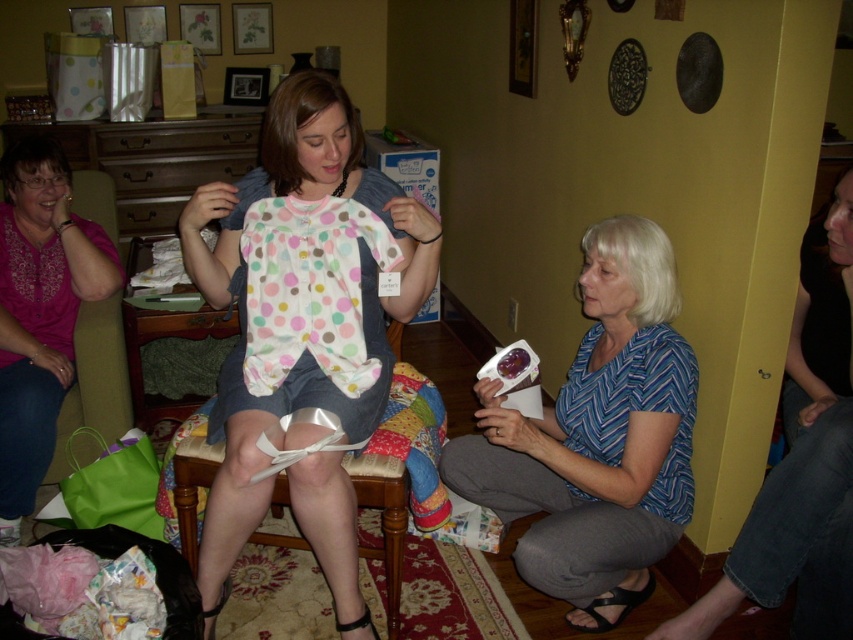
Question: Is matte polka dot onesie at center further to camera compared to blue striped shirt at lower right?

Choices:
 (A) no
 (B) yes

Answer: (A)

Question: Which object is positioned farthest from the blue striped shirt at lower right?

Choices:
 (A) matte polka dot onesie at center
 (B) blue chevron shirt at lower right
 (C) pink embroidered blouse at upper left

Answer: (C)

Question: Which point appears closest to the camera in this image?

Choices:
 (A) (587, 240)
 (B) (810, 333)

Answer: (A)

Question: Is blue chevron shirt at lower right positioned behind pink embroidered blouse at upper left?

Choices:
 (A) yes
 (B) no

Answer: (B)

Question: Which object appears farthest from the camera in this image?

Choices:
 (A) pink embroidered blouse at upper left
 (B) matte polka dot onesie at center
 (C) blue chevron shirt at lower right

Answer: (A)

Question: Does blue striped shirt at lower right have a lesser width compared to blue chevron shirt at lower right?

Choices:
 (A) no
 (B) yes

Answer: (A)